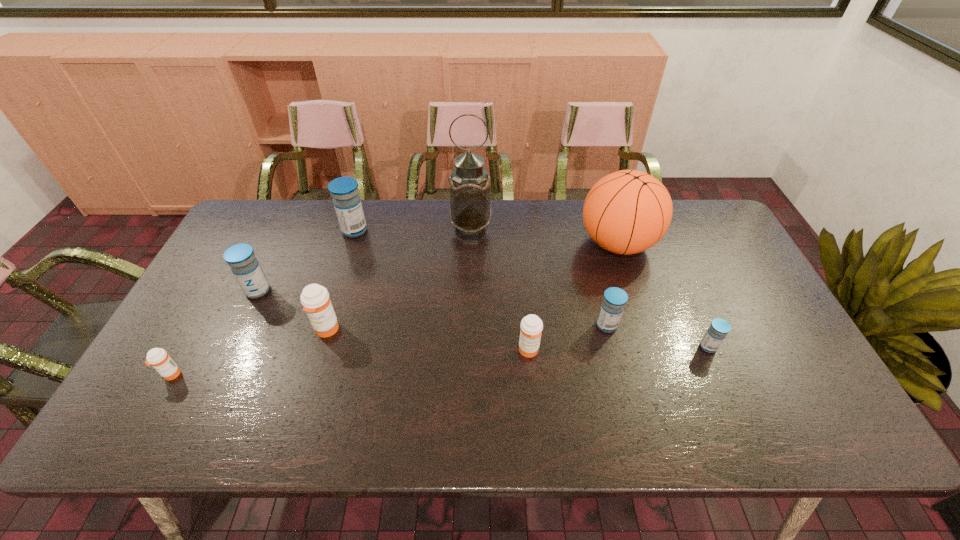
The width and height of the screenshot is (960, 540). Identify the location of vacant region at the left edge of the desktop. (222, 288).

Identify the location of free space at the right edge of the desktop. This screenshot has width=960, height=540. (759, 368).

Where is `vacant space at the far left corner of the desktop`? This screenshot has height=540, width=960. vacant space at the far left corner of the desktop is located at coordinates (266, 226).

In the image, there is a desktop. Where is `free space at the near left corner`? This screenshot has width=960, height=540. free space at the near left corner is located at coordinates (202, 407).

Find the location of a particular element. The image size is (960, 540). unoccupied position between the nearest blue medicine and the biggest orange medicine is located at coordinates (517, 338).

At what (x,y) coordinates should I click in order to perform the action: click on vacant point located between the basketball and the second medicine from right to left. Please return your answer as a coordinate pair (x, y). Image resolution: width=960 pixels, height=540 pixels. Looking at the image, I should click on (612, 284).

Where is `unoccupied position between the leftmost medicine and the second medicine from left to right`? unoccupied position between the leftmost medicine and the second medicine from left to right is located at coordinates (214, 333).

Where is `free space between the leftmost blue medicine and the biggest orange medicine`? The height and width of the screenshot is (540, 960). free space between the leftmost blue medicine and the biggest orange medicine is located at coordinates (292, 310).

Identify the location of free point between the leftmost medicine and the tallest medicine. The height and width of the screenshot is (540, 960). (263, 302).

Find the location of a particular element. free area in between the fifth medicine from left to right and the third blue medicine from right to left is located at coordinates (442, 291).